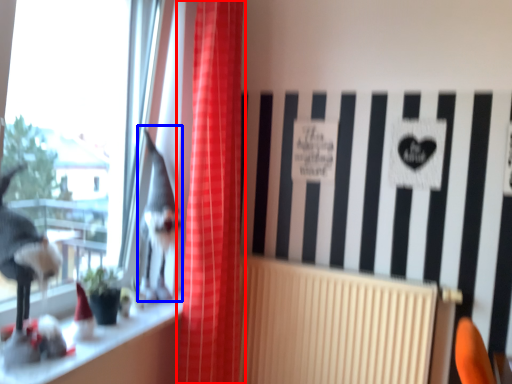
Question: Among these objects, which one is farthest to the camera, curtain (highlighted by a red box) or animal (highlighted by a blue box)?

Choices:
 (A) curtain
 (B) animal

Answer: (B)